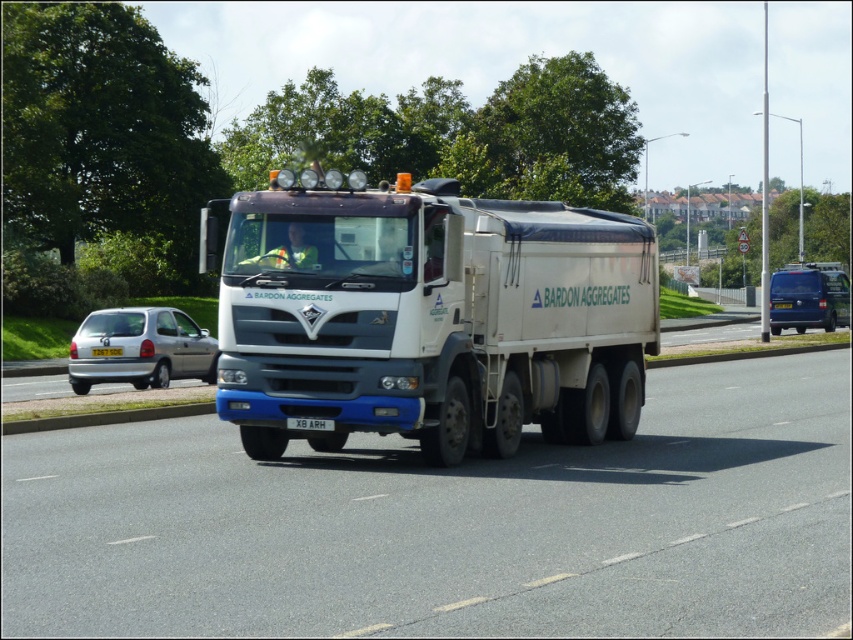
Is point (746, 435) closer to camera compared to point (291, 417)?

No.

Which is below, white rubber asphalt road at center or black plastic license plate at center?

Positioned lower is white rubber asphalt road at center.

Between point (85, 529) and point (300, 428), which one is positioned behind?

The point (300, 428) is more distant.

Find the location of `white rubber asphalt road at center`. white rubber asphalt road at center is located at coordinates (450, 524).

Between point (198, 541) and point (778, 317), which one is positioned in front?

Point (198, 541)

Is white rubber asphalt road at center further to camera compared to blue metallic van at right?

No, white rubber asphalt road at center is closer to the viewer.

Between point (273, 561) and point (779, 272), which one is positioned in front?

Point (273, 561) is more forward.

At what (x,y) coordinates should I click in order to perform the action: click on white rubber asphalt road at center. Please return your answer as a coordinate pair (x, y). The image size is (853, 640). Looking at the image, I should click on (450, 524).

Is white rubber asphalt road at center further to the viewer compared to yellow plastic license plate at center?

No, it is not.

Is white rubber asphalt road at center wider than yellow plastic license plate at center?

Indeed, white rubber asphalt road at center has a greater width compared to yellow plastic license plate at center.

Which is behind, point (531, 577) or point (103, 349)?

Positioned behind is point (103, 349).

The image size is (853, 640). Find the location of `white rubber asphalt road at center`. white rubber asphalt road at center is located at coordinates (450, 524).